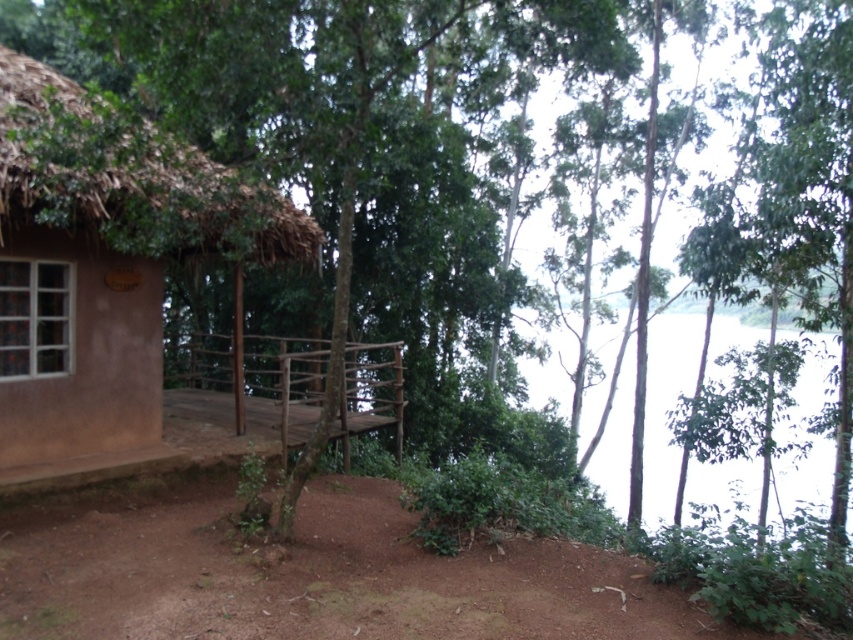
Question: Is brown clay hut at left closer to the viewer compared to wooden at center?

Choices:
 (A) no
 (B) yes

Answer: (B)

Question: Which of the following is the farthest from the observer?

Choices:
 (A) brown clay hut at left
 (B) wooden at center

Answer: (B)

Question: Is brown clay hut at left to the right of wooden at center from the viewer's perspective?

Choices:
 (A) no
 (B) yes

Answer: (A)

Question: Does brown clay hut at left have a larger size compared to wooden at center?

Choices:
 (A) no
 (B) yes

Answer: (A)